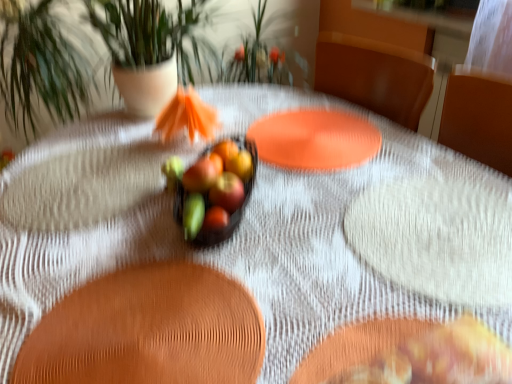
Where is `free spot to the right of glossy red apple at center, the second apple in the back-to-front sequence`? The height and width of the screenshot is (384, 512). free spot to the right of glossy red apple at center, the second apple in the back-to-front sequence is located at coordinates (329, 233).